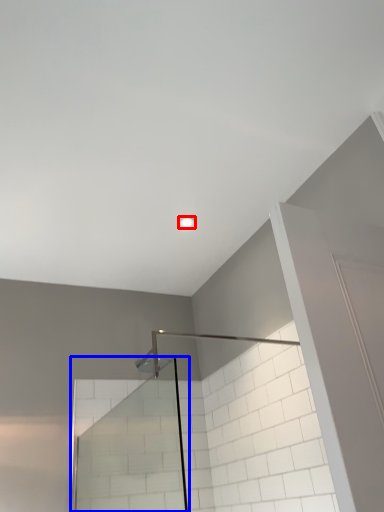
Question: Among these objects, which one is nearest to the camera, light fixture (highlighted by a red box) or glass door (highlighted by a blue box)?

Choices:
 (A) light fixture
 (B) glass door

Answer: (B)